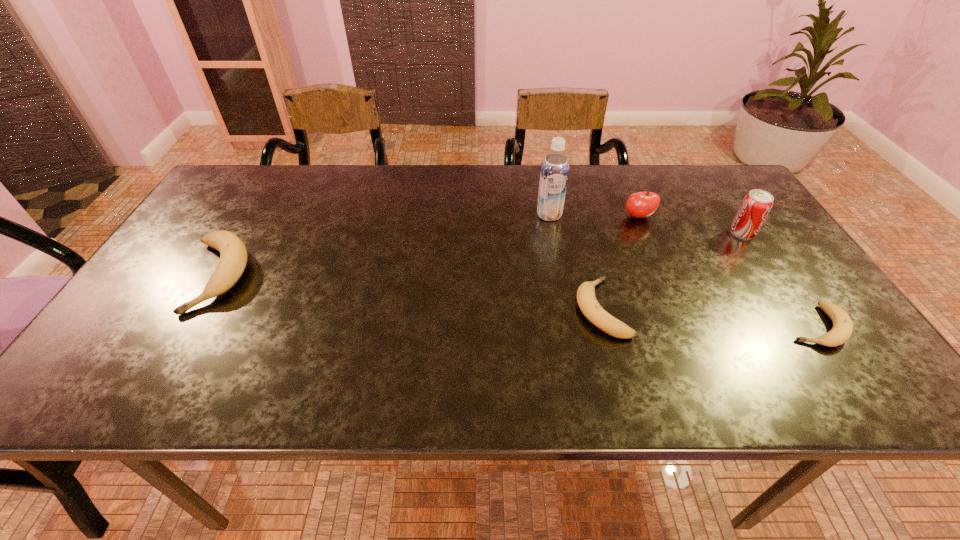
Identify the location of banana identified as the second closest to the tallest banana. This screenshot has height=540, width=960. (842, 329).

This screenshot has height=540, width=960. In order to click on vacant space that satisfies the following two spatial constraints: 1. on the front side of the leftmost banana; 2. on the left side of the shortest banana in this screenshot , I will do `click(186, 326)`.

The height and width of the screenshot is (540, 960). In order to click on free space that satisfies the following two spatial constraints: 1. on the label of the fourth shortest object; 2. on the left side of the soya milk in this screenshot , I will do `click(549, 217)`.

I want to click on vacant point that satisfies the following two spatial constraints: 1. on the label of the apple; 2. on the right side of the soya milk, so click(549, 217).

Locate an element on the screen. This screenshot has height=540, width=960. free space that satisfies the following two spatial constraints: 1. on the back side of the fifth shortest object; 2. on the left side of the tallest banana is located at coordinates (242, 233).

Find the location of a particular element. The height and width of the screenshot is (540, 960). blank space that satisfies the following two spatial constraints: 1. on the label of the tallest object; 2. on the left side of the second tallest object is located at coordinates (552, 233).